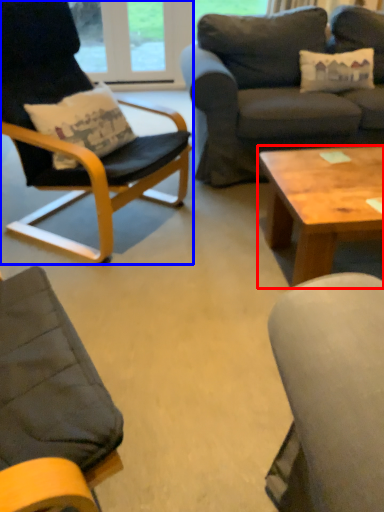
Question: Which object appears closest to the camera in this image, coffee table (highlighted by a red box) or chair (highlighted by a blue box)?

Choices:
 (A) coffee table
 (B) chair

Answer: (B)